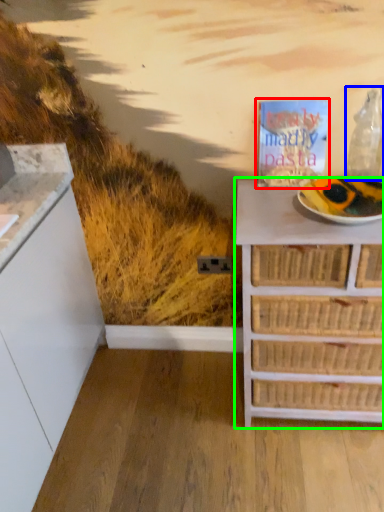
Question: Based on their relative distances, which object is nearer to magazine (highlighted by a red box)? Choose from wine bottle (highlighted by a blue box) and chest of drawers (highlighted by a green box).

Choices:
 (A) wine bottle
 (B) chest of drawers

Answer: (A)